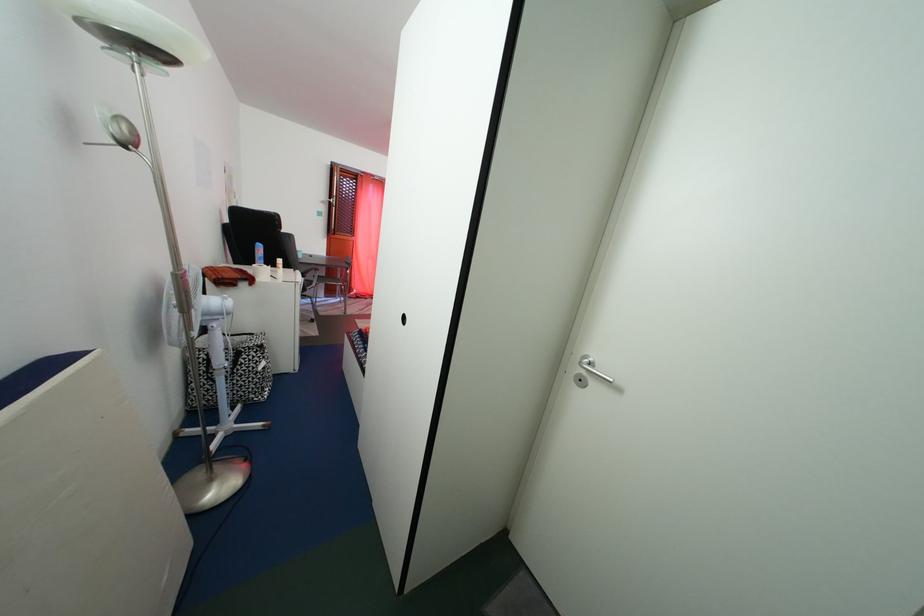
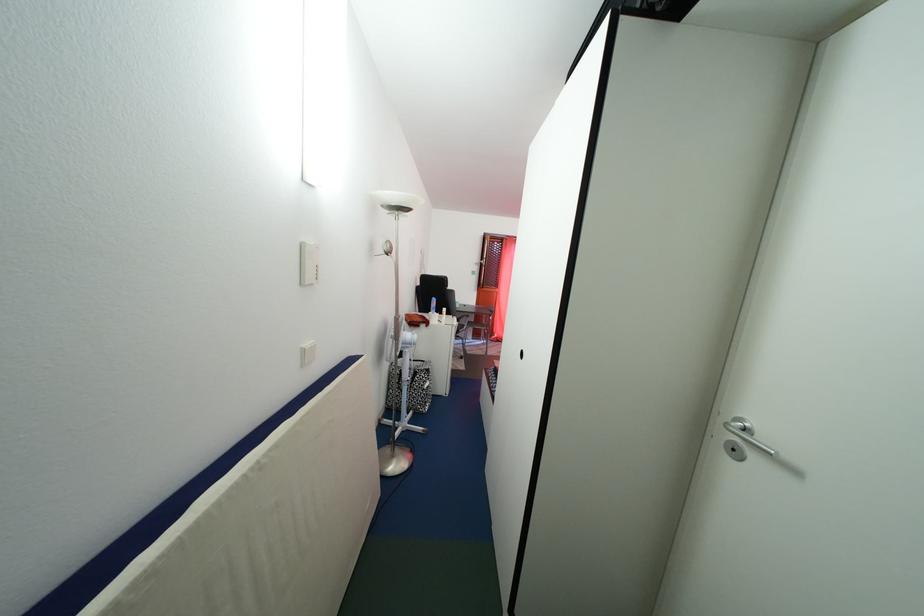
Where in the second image is the point corresponding to (247,361) from the first image?

(423, 381)